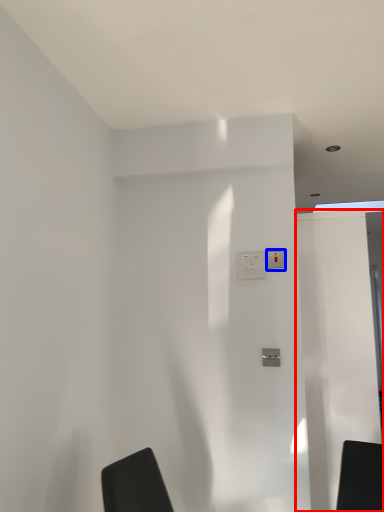
Question: Which of the following is the closest to the observer, screen door (highlighted by a red box) or light switch (highlighted by a blue box)?

Choices:
 (A) screen door
 (B) light switch

Answer: (B)